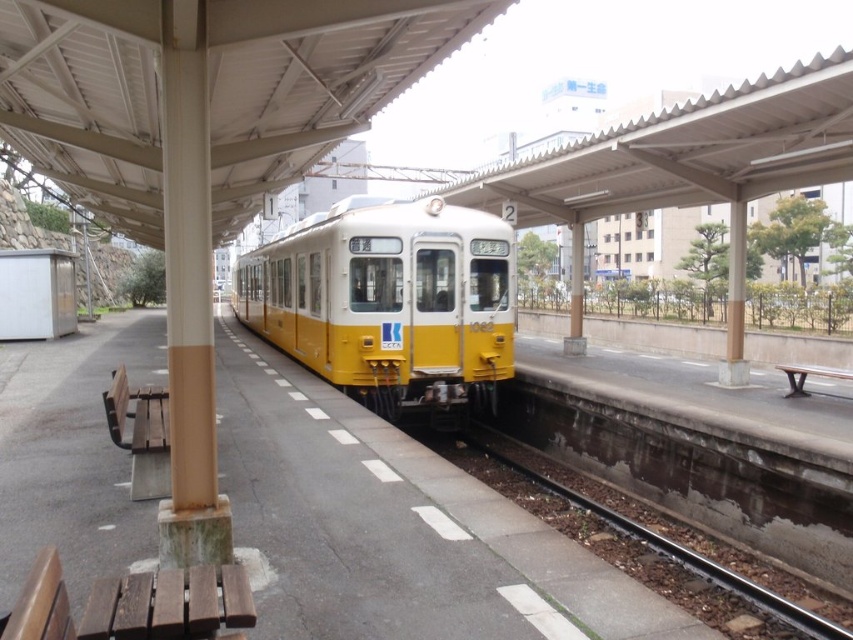
From the picture: You are waiting for your train at the station and notice the yellow matte train at center and the brown gravel at lower center. Which object takes up more horizontal space in the image?

The yellow matte train at center takes up more horizontal space than the brown gravel at lower center because its width is larger.

Based on the photo, you are waiting on the wooden bench at the train station. You see the yellow matte train at center and the brown gravel at lower center. Which object is closer to you?

The brown gravel at lower center is behind the yellow matte train at center, so the yellow matte train at center is closer to you.

You are waiting on the wooden bench and want to walk to the edge of the platform. Which direction should you move relative to the yellow matte train at center and the brown gravel at lower center?

You should move to the right side of the yellow matte train at center and away from the brown gravel at lower center since the brown gravel is on the left side of the train, and the platform edge is marked by white lines which are likely on the right side relative to the train.